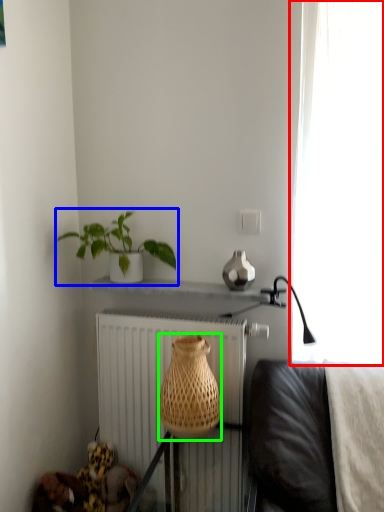
Question: Which is nearer to the curtain (highlighted by a red box)? houseplant (highlighted by a blue box) or basket (highlighted by a green box).

Choices:
 (A) houseplant
 (B) basket

Answer: (B)